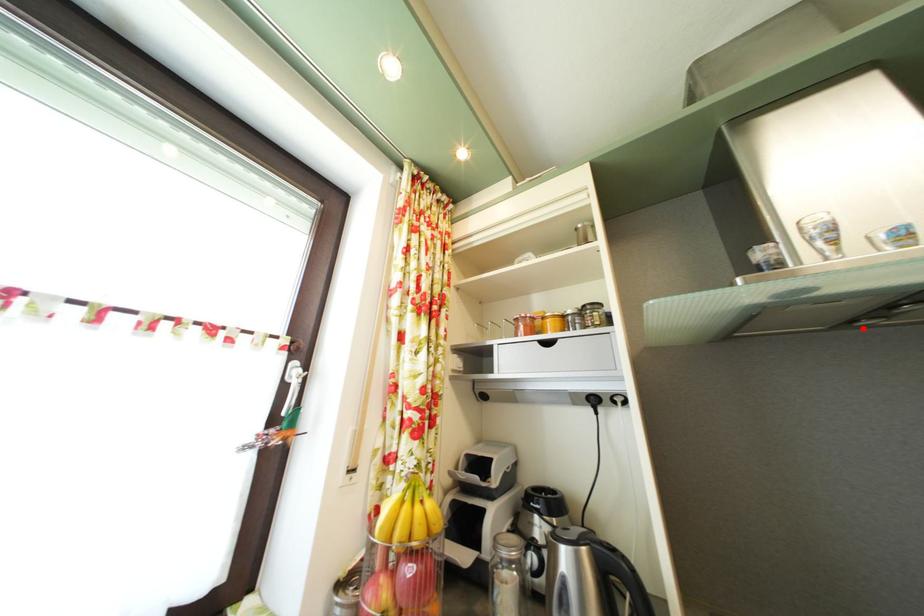
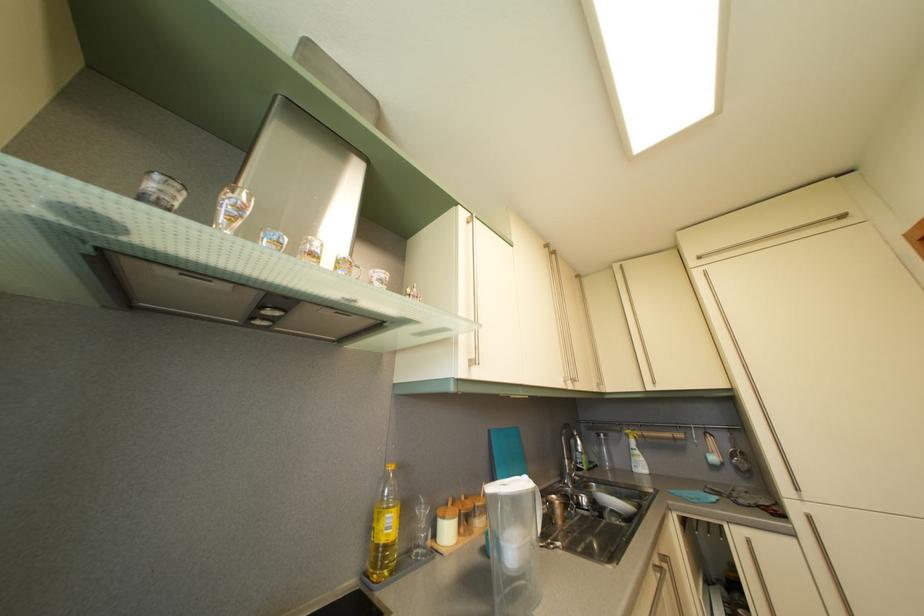
Where in the second image is the point corresponding to the highlighted location from the first image?

(261, 326)